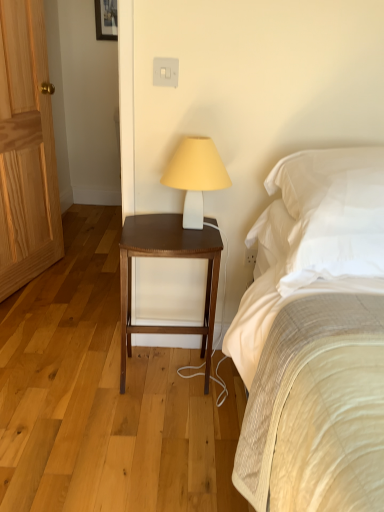
Locate an element on the screen. vacant location below natural wood door at left (from a real-world perspective) is located at coordinates (31, 286).